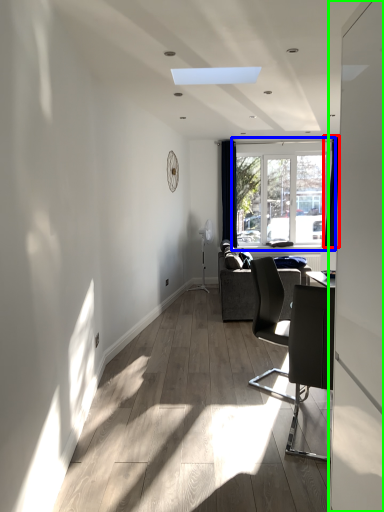
Question: Which object is positioned closest to curtain (highlighted by a red box)? Select from window (highlighted by a blue box) and screen door (highlighted by a green box).

Choices:
 (A) window
 (B) screen door

Answer: (A)